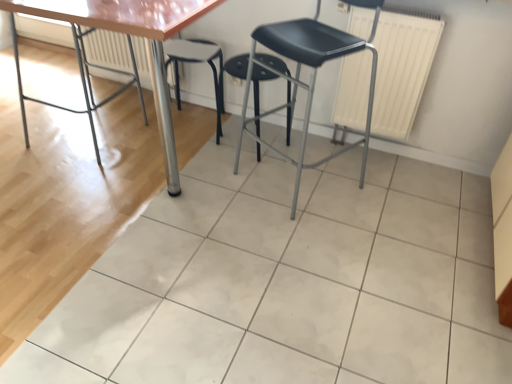
Find the location of a particular element. This screenshot has height=384, width=512. vacant area that is in front of black plastic stool at center, the 1th stool viewed from the right is located at coordinates (224, 176).